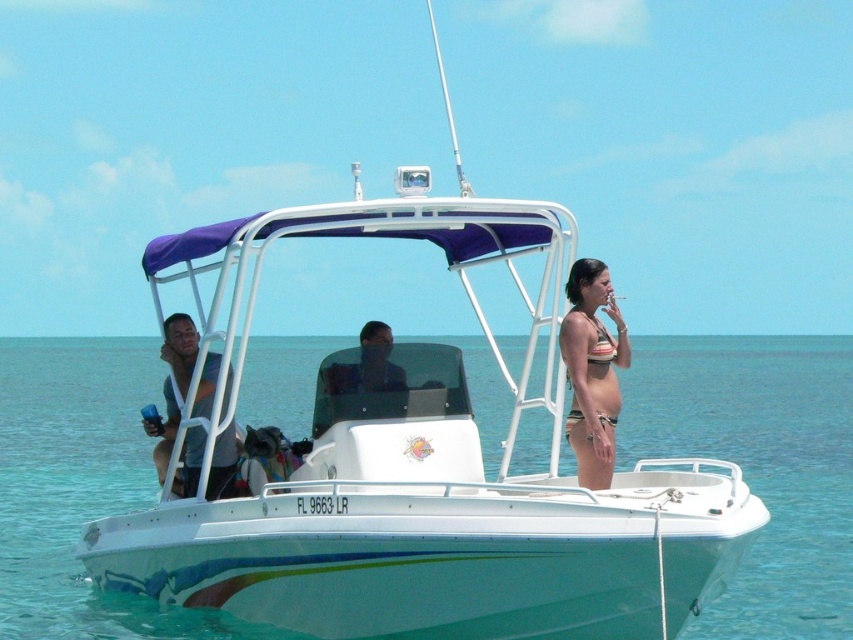
What is the 2D coordinate of the clear blue water at boat center?

The 2D coordinate of the clear blue water at boat center is at point (759,467).

You are standing on a dock 10 meters away from the motorboat. You see the light blue fabric shirt at center. Can you reach it with a 3 meter long pole?

The distance of light blue fabric shirt at center from viewer is 11.87 meters. Since the pole is only 3 meters long, you cannot reach it from 10 meters away.